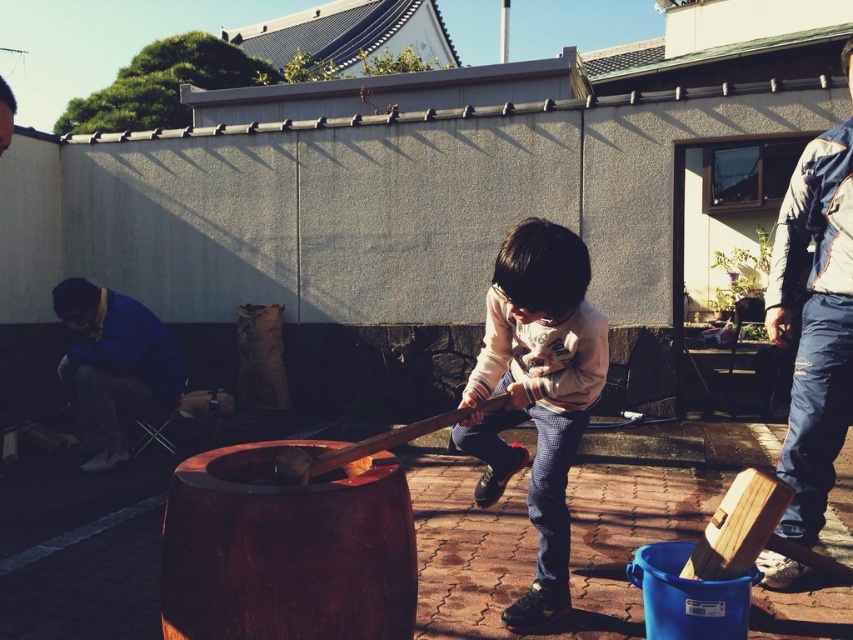
Question: Is the position of dark brown wooden barrel at center more distant than that of white fleece sweater at center?

Choices:
 (A) yes
 (B) no

Answer: (B)

Question: Which of the following is the closest to the observer?

Choices:
 (A) denim overalls at right
 (B) dark brown wooden barrel at center

Answer: (B)

Question: Does white fleece sweater at center come in front of denim overalls at right?

Choices:
 (A) yes
 (B) no

Answer: (A)

Question: Is dark brown wooden barrel at center wider than denim overalls at right?

Choices:
 (A) no
 (B) yes

Answer: (B)

Question: Based on their relative distances, which object is nearer to the denim overalls at right?

Choices:
 (A) blue fabric at left
 (B) white fleece sweater at center

Answer: (B)

Question: Which object appears closest to the camera in this image?

Choices:
 (A) white fleece sweater at center
 (B) blue fabric at left
 (C) denim overalls at right

Answer: (A)